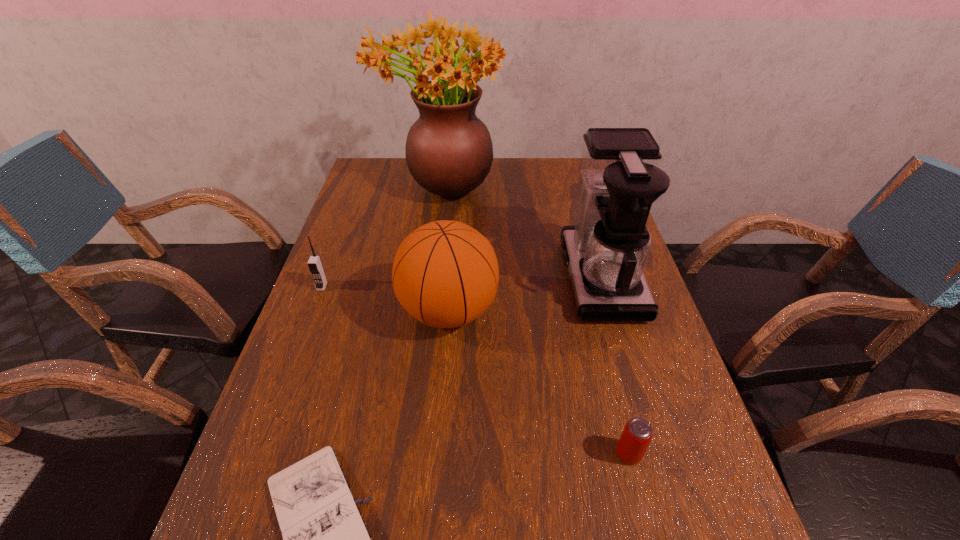
Where is `the farthest object`? the farthest object is located at coordinates (449, 152).

You are a GUI agent. You are given a task and a screenshot of the screen. Output one action in this format:
    pyautogui.click(x=<x>, y=<y>)
    Task: Click on the tallest object
    The width and height of the screenshot is (960, 540).
    Given the screenshot: What is the action you would take?
    pyautogui.click(x=449, y=152)

What are the coordinates of `coffee maker` in the screenshot? It's located at (606, 252).

Locate an element on the screen. The width and height of the screenshot is (960, 540). the third tallest object is located at coordinates (445, 274).

The image size is (960, 540). Identify the location of the third shortest object. (315, 265).

In order to click on cellular telephone in this screenshot , I will do `click(315, 265)`.

The width and height of the screenshot is (960, 540). Find the location of `the fifth tallest object`. the fifth tallest object is located at coordinates (637, 434).

You are a GUI agent. You are given a task and a screenshot of the screen. Output one action in this format:
    pyautogui.click(x=<x>, y=<y>)
    Task: Click on the free spot located 0.220m on the front of the tallest object
    The image size is (960, 540).
    Given the screenshot: What is the action you would take?
    pyautogui.click(x=431, y=262)

What are the coordinates of `vacant area situated at the front of the coffee maker where the controls are located` in the screenshot? It's located at (421, 278).

At what (x,y) coordinates should I click in order to perform the action: click on vacant area situated 0.220m at the front of the coffee maker where the controls are located. Please return your answer as a coordinate pair (x, y). The width and height of the screenshot is (960, 540). Looking at the image, I should click on (481, 278).